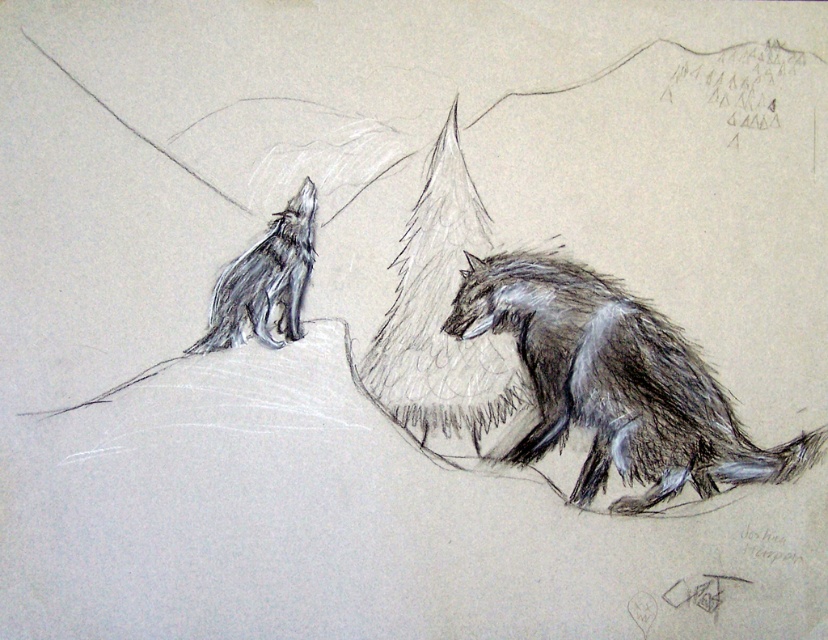
Question: Is shaggy fur coyote at right thinner than shaggy fur wolf at upper left?

Choices:
 (A) yes
 (B) no

Answer: (B)

Question: Is shaggy fur coyote at right positioned in front of shaggy fur wolf at upper left?

Choices:
 (A) no
 (B) yes

Answer: (B)

Question: Which point is closer to the camera?

Choices:
 (A) (634, 513)
 (B) (287, 252)

Answer: (A)

Question: Can you confirm if shaggy fur coyote at right is thinner than shaggy fur wolf at upper left?

Choices:
 (A) no
 (B) yes

Answer: (A)

Question: Among these objects, which one is nearest to the camera?

Choices:
 (A) shaggy fur coyote at right
 (B) shaggy fur wolf at upper left

Answer: (A)

Question: Which point appears farthest from the camera in this image?

Choices:
 (A) (263, 342)
 (B) (679, 420)

Answer: (A)